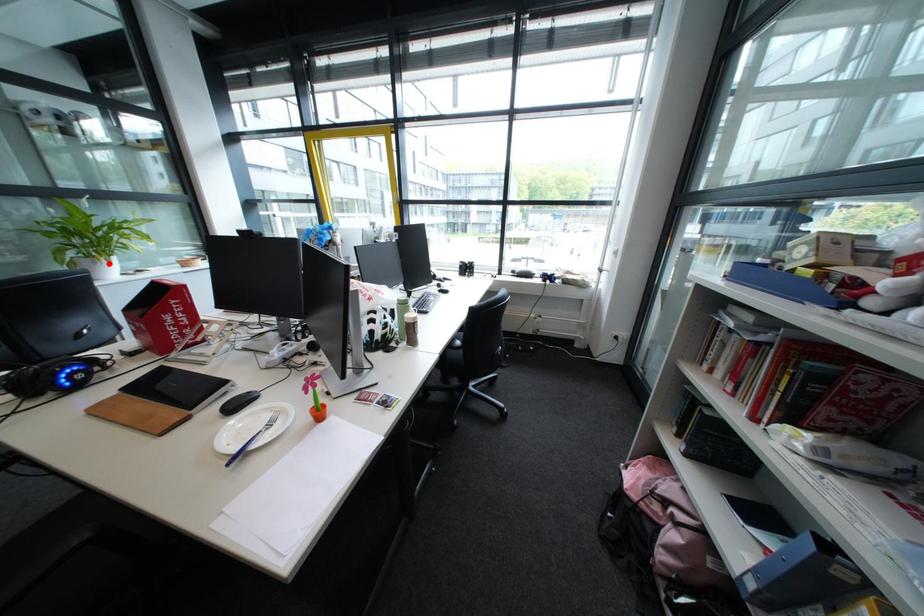
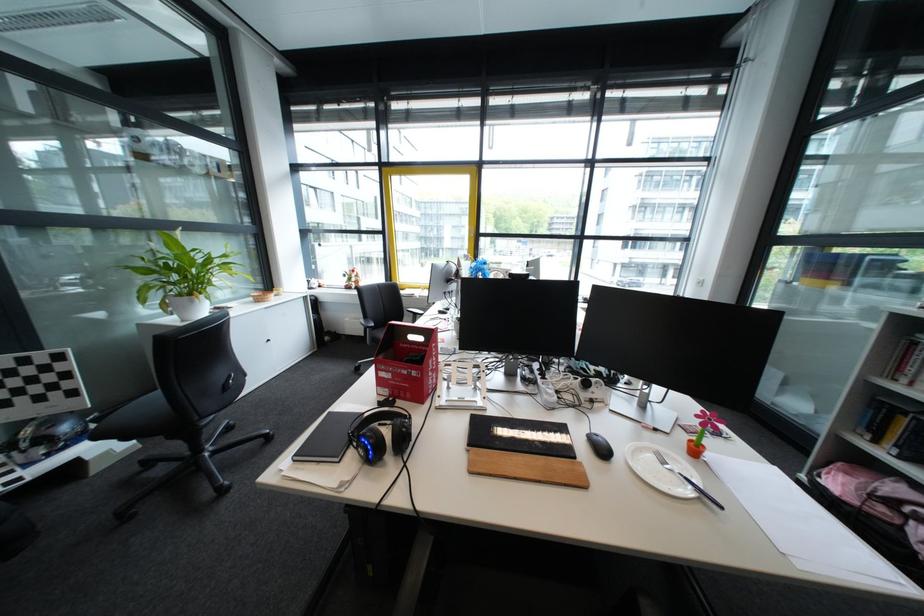
Question: I am providing you with two images of the same scene from different viewpoints. In image1, a red point is highlighted. Considering the same 3D point in image2, which of the following is correct?

Choices:
 (A) It is closer
 (B) It is farther

Answer: (A)